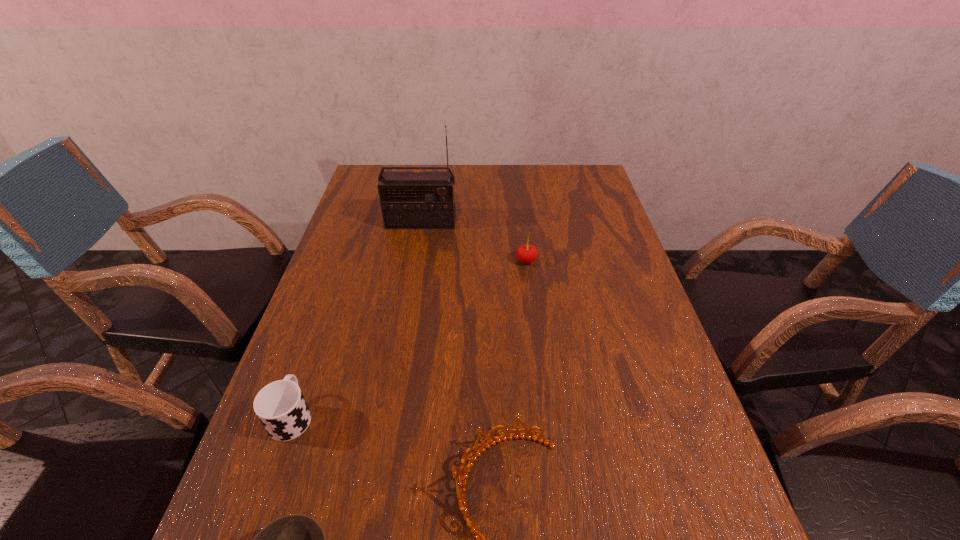
Find the location of a particular element. The width and height of the screenshot is (960, 540). the farthest object is located at coordinates (409, 200).

This screenshot has width=960, height=540. I want to click on the tallest object, so click(x=409, y=200).

Locate an element on the screen. Image resolution: width=960 pixels, height=540 pixels. the fourth nearest object is located at coordinates (526, 254).

Find the location of a particular element. This screenshot has height=540, width=960. cup is located at coordinates (280, 406).

Where is `free point located 0.230m on the front panel of the farthest object`? The height and width of the screenshot is (540, 960). free point located 0.230m on the front panel of the farthest object is located at coordinates click(411, 280).

Find the location of a particular element. The image size is (960, 540). free space located on the left of the fourth nearest object is located at coordinates (438, 261).

This screenshot has width=960, height=540. I want to click on vacant space located on the side of the cup with the handle, so click(x=341, y=275).

The width and height of the screenshot is (960, 540). Identify the location of free point located on the side of the cup with the handle. (335, 293).

Locate an element on the screen. This screenshot has width=960, height=540. vacant space located on the side of the cup with the handle is located at coordinates (310, 364).

Where is `radio receiver that is at the left edge`? The height and width of the screenshot is (540, 960). radio receiver that is at the left edge is located at coordinates click(x=409, y=200).